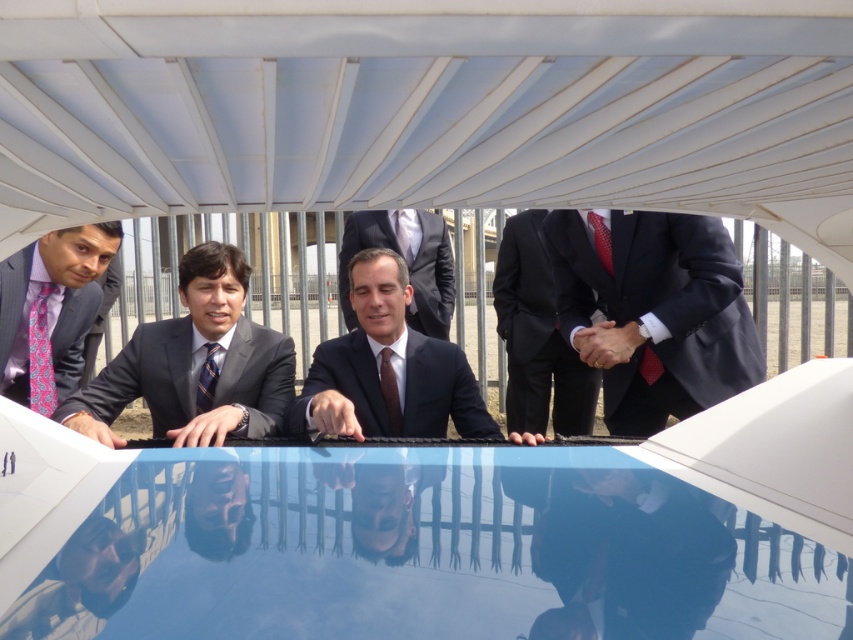
Does point (605, 230) come closer to viewer compared to point (402, 234)?

Yes.

Identify the location of red dotted tie at right. The image size is (853, 640). (601, 241).

Is dark blue suit at right behind pink patterned tie at left?

No, dark blue suit at right is closer to the viewer.

Which is more to the left, dark blue suit at right or pink patterned tie at left?

pink patterned tie at left

Does point (653, 296) come behind point (36, 392)?

No.

The height and width of the screenshot is (640, 853). What are the coordinates of `dark blue suit at right` in the screenshot? It's located at (654, 314).

Which is above, black satin suit at center or matte black tie at center?

matte black tie at center is above.

Is point (515, 362) in front of point (403, 248)?

Yes, it is.

You are a GUI agent. You are given a task and a screenshot of the screen. Output one action in this format:
    pyautogui.click(x=<x>, y=<y>)
    Task: Click on the black satin suit at center
    The height and width of the screenshot is (640, 853).
    Given the screenshot: What is the action you would take?
    pyautogui.click(x=537, y=337)